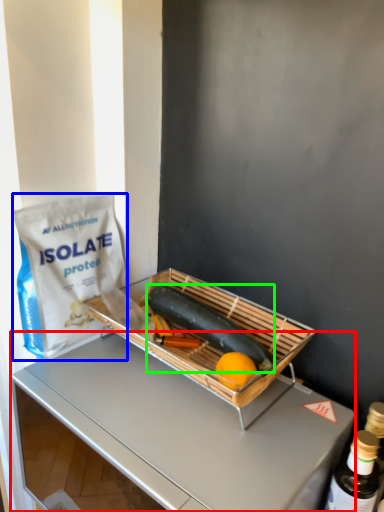
Question: Which object is the farthest from desk (highlighted by a red box)? Choose among these: grocery bag (highlighted by a blue box) or green vegetables (highlighted by a green box).

Choices:
 (A) grocery bag
 (B) green vegetables

Answer: (B)